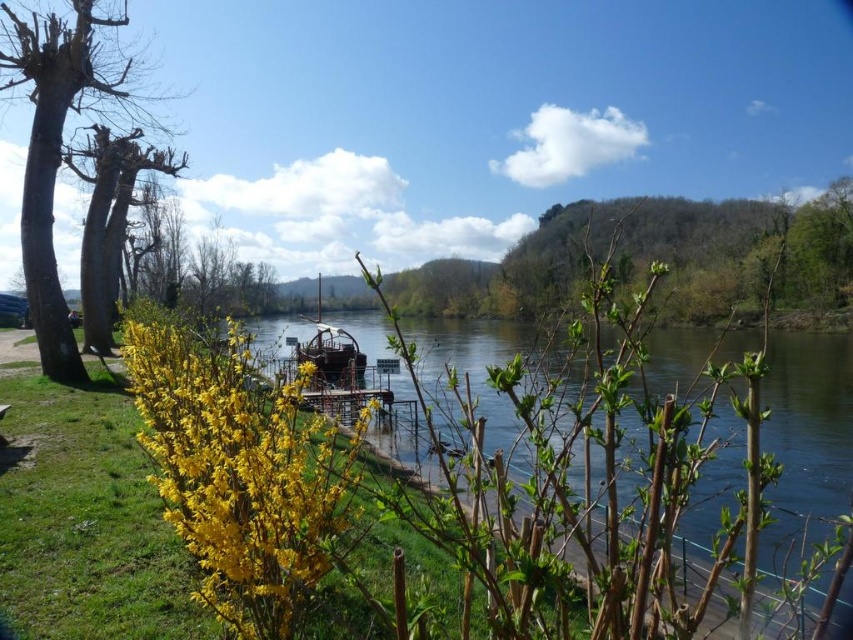
Is yellow matte flower at center further to the viewer compared to bare wood tree at left?

No, it is not.

Does yellow matte flower at center come in front of bare wood tree at left?

Yes, yellow matte flower at center is in front of bare wood tree at left.

Is point (190, 371) positioned behind point (91, 269)?

No, (190, 371) is closer to viewer.

The width and height of the screenshot is (853, 640). Identify the location of yellow matte flower at center. (241, 470).

Does smooth bark tree at left have a greater width compared to wooden boat at center?

In fact, smooth bark tree at left might be narrower than wooden boat at center.

Who is shorter, smooth bark tree at left or wooden boat at center?

Standing shorter between the two is smooth bark tree at left.

Between point (85, 97) and point (352, 387), which one is positioned behind?

The point (352, 387) is behind.

At what (x,y) coordinates should I click in order to perform the action: click on smooth bark tree at left. Please return your answer as a coordinate pair (x, y). Image resolution: width=853 pixels, height=640 pixels. Looking at the image, I should click on (59, 138).

Which is in front, point (161, 170) or point (305, 332)?

Point (161, 170) is in front.

Is point (102, 196) more distant than point (822, 412)?

That is True.

Does point (90, 246) come farther from viewer compared to point (824, 372)?

No, (90, 246) is closer to viewer.

Where is `bare wood tree at left`? This screenshot has height=640, width=853. bare wood tree at left is located at coordinates (109, 225).